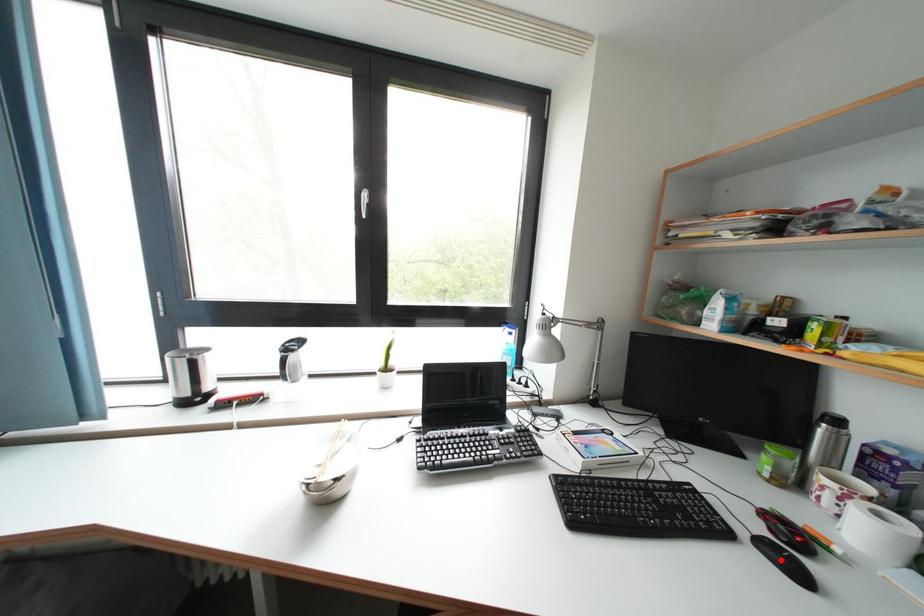
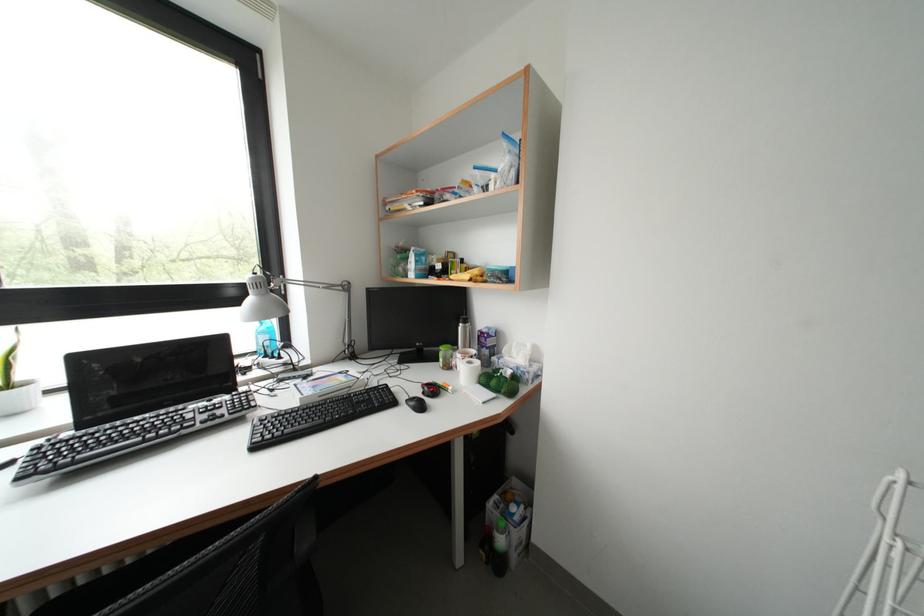
In the second image, find the point that corresponds to the highlighted location in the first image.

(419, 408)